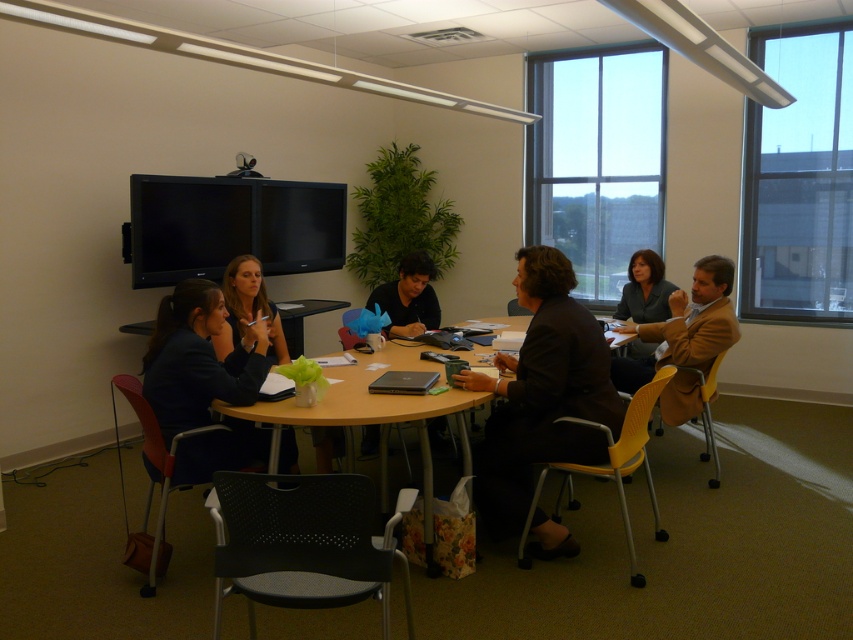
Consider the image. You are a person who is 6 feet tall and standing in the meeting room. You need to place a matte black blazer at lower left onto the wooden round table at center. Can you reach the table without moving your feet?

The matte black blazer at lower left is 10.15 inches from the wooden round table at center. Since the distance is less than an arm length, you can easily reach the wooden round table at center from the matte black blazer at lower left without moving your feet.

You are a guest entering the meeting room and need to sit down. You see the matte black blazer at lower left and the wooden round table at center. Which object is closer to the entrance of the room?

The matte black blazer at lower left is closer to the entrance of the room because the wooden round table at center is behind it.